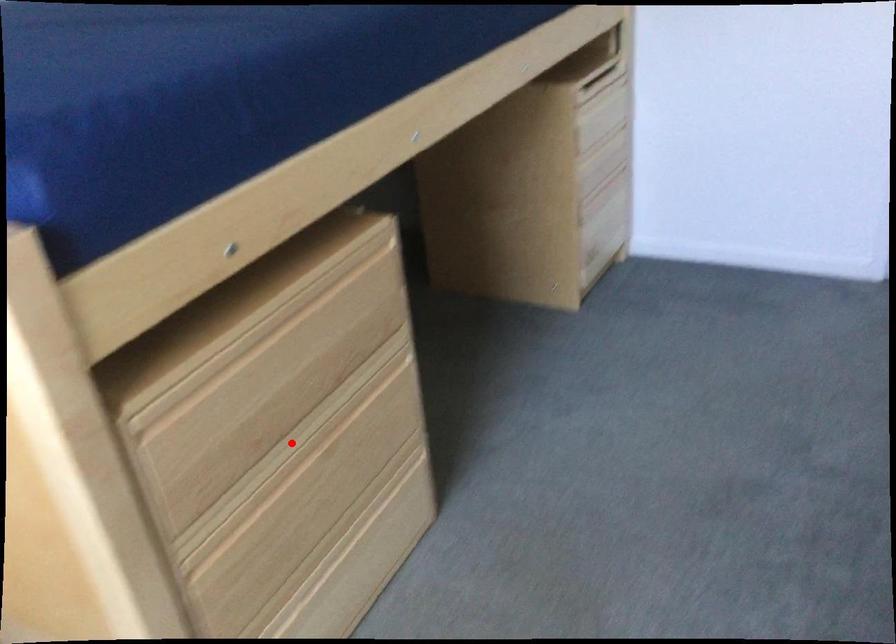
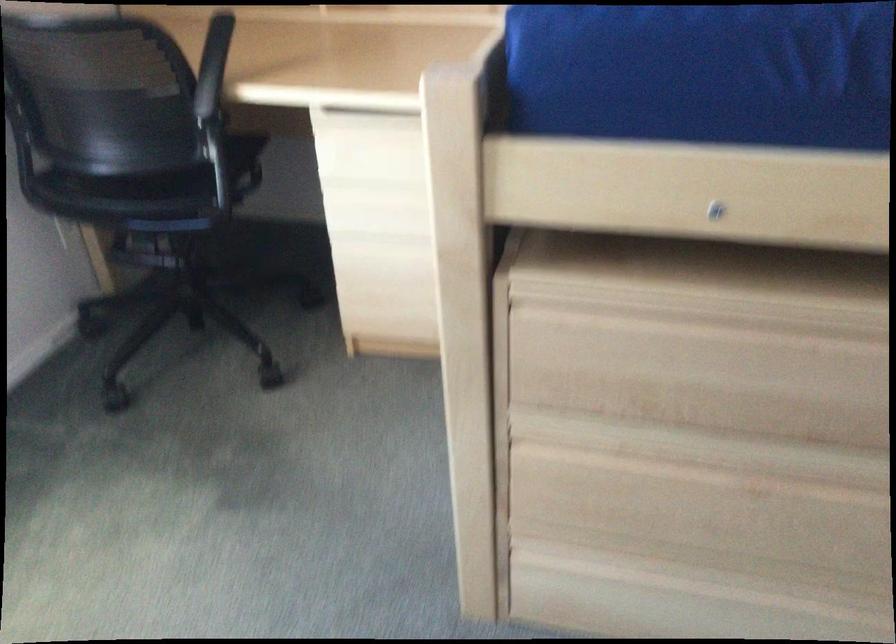
Locate, in the second image, the point that corresponds to the highlighted location in the first image.

(716, 451)